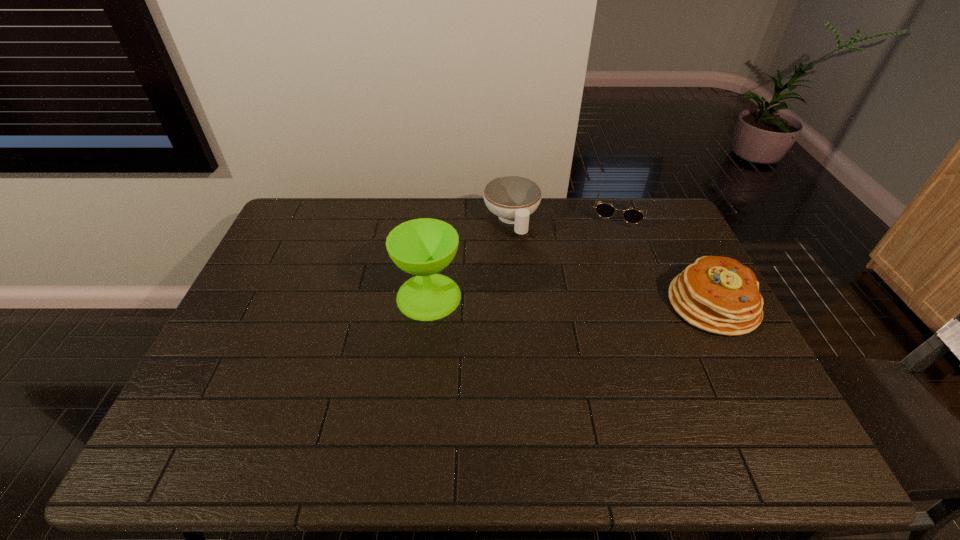
Identify the location of free region located 0.100m on the front lenses of the shortest object. The image size is (960, 540). (609, 248).

Identify the location of free space located 0.220m on the side with the handle of the third tallest object. (538, 288).

Find the location of a particular element. vacant position located on the side with the handle of the third tallest object is located at coordinates (551, 320).

Identify the location of vacant space located on the side with the handle of the third tallest object. (551, 320).

The image size is (960, 540). I want to click on sunglasses that is at the far edge, so click(633, 216).

The height and width of the screenshot is (540, 960). Find the location of `chinaware located in the far edge section of the desktop`. chinaware located in the far edge section of the desktop is located at coordinates (512, 198).

This screenshot has height=540, width=960. In order to click on pancake positioned at the right edge in this screenshot , I will do `click(718, 294)`.

Where is `sunglasses situated at the right edge`? sunglasses situated at the right edge is located at coordinates point(633,216).

The width and height of the screenshot is (960, 540). In order to click on object that is at the far right corner in this screenshot , I will do `click(633, 216)`.

I want to click on free space at the far edge of the desktop, so click(x=382, y=235).